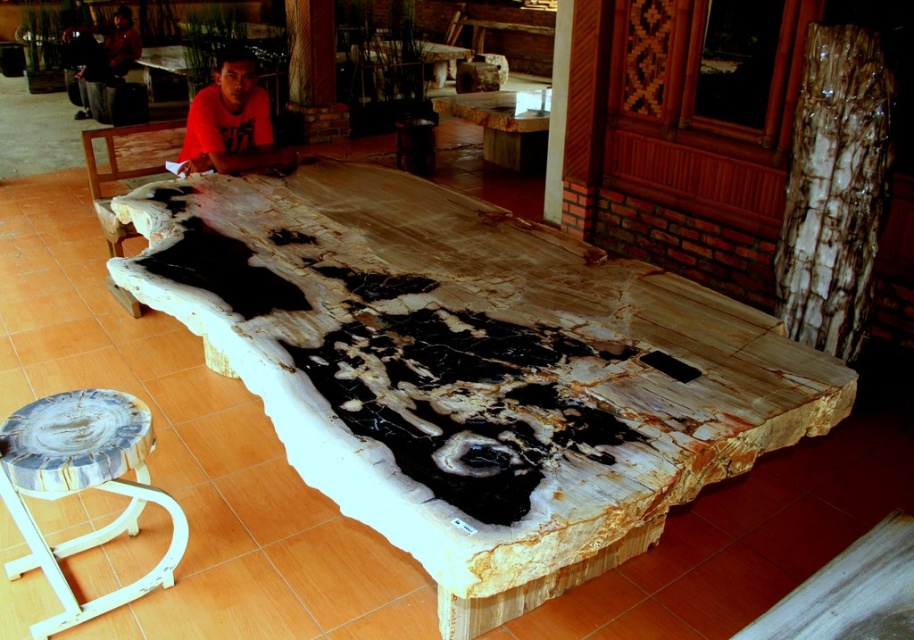
Does black and white marble table at center have a smaller size compared to polished wood table at center?

No, black and white marble table at center is not smaller than polished wood table at center.

Between black and white marble table at center and polished wood table at center, which one appears on the left side from the viewer's perspective?

black and white marble table at center is more to the left.

Locate an element on the screen. The height and width of the screenshot is (640, 914). black and white marble table at center is located at coordinates (x=454, y=326).

Who is positioned more to the right, black and white marble table at center or dark brown leather jacket at upper left?

black and white marble table at center is more to the right.

Is black and white marble table at center bigger than dark brown leather jacket at upper left?

Indeed, black and white marble table at center has a larger size compared to dark brown leather jacket at upper left.

Does point (187, 317) come in front of point (126, 44)?

That is True.

Identify the location of black and white marble table at center. tap(454, 326).

Can you confirm if natural wood stool at lower left is positioned to the left of matte orange shirt at center?

In fact, natural wood stool at lower left is to the right of matte orange shirt at center.

Is point (73, 404) farther from camera compared to point (228, 56)?

No, it is not.

Who is more forward, (178, 529) or (218, 93)?

Point (178, 529) is in front.

Where is `natural wood stool at lower left`? natural wood stool at lower left is located at coordinates (82, 486).